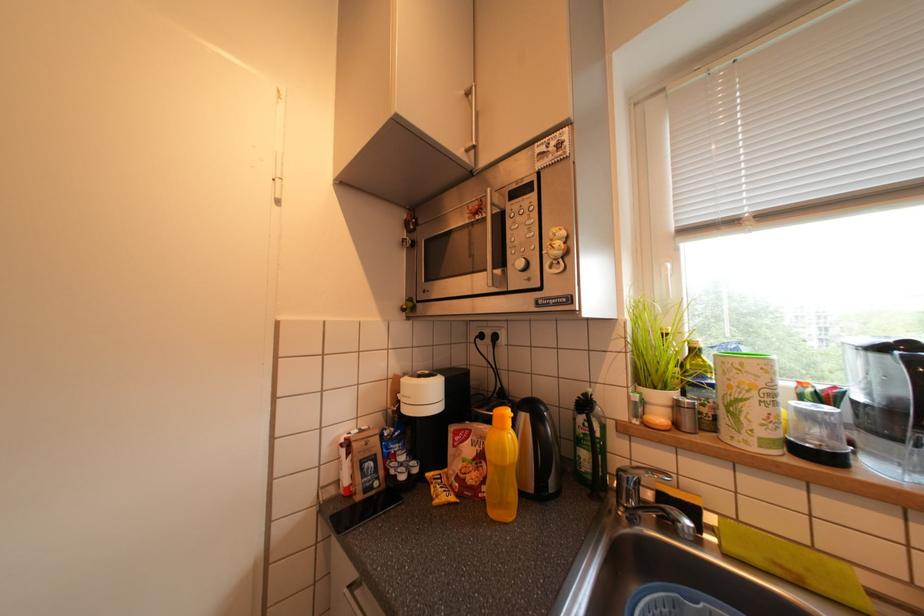
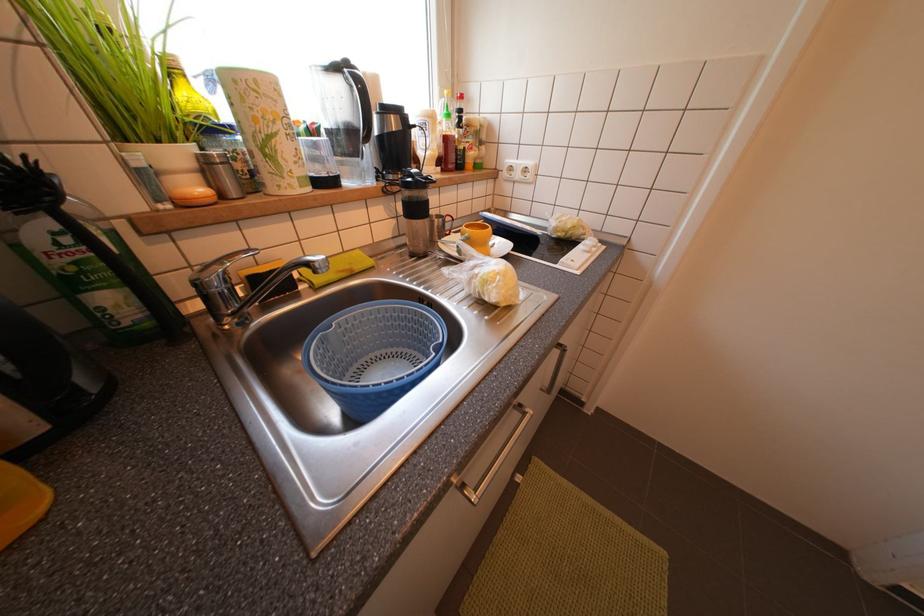
Based on the continuous images, in which direction is the camera rotating?

The rotation direction of the camera is right-down.